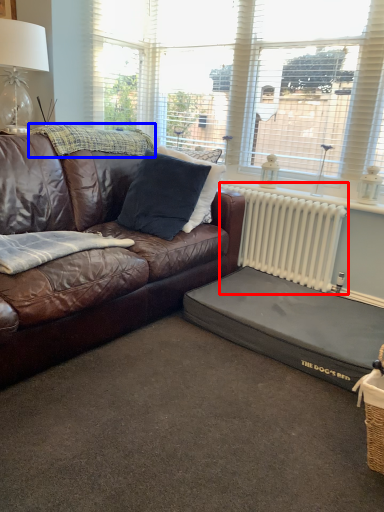
Question: Which object is further to the camera taking this photo, radiator (highlighted by a red box) or blanket (highlighted by a blue box)?

Choices:
 (A) radiator
 (B) blanket

Answer: (A)